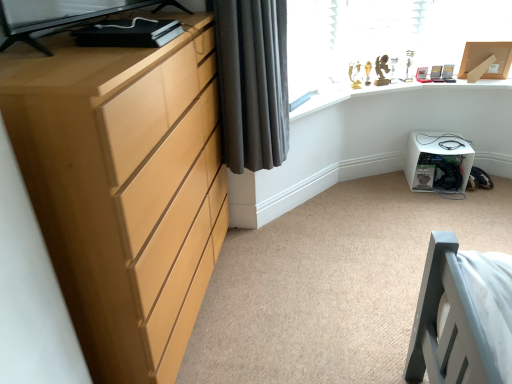
Question: Considering the relative sizes of dark grey fabric curtain at upper left and white plastic storage box at lower right in the image provided, is dark grey fabric curtain at upper left wider than white plastic storage box at lower right?

Choices:
 (A) no
 (B) yes

Answer: (B)

Question: Is dark grey fabric curtain at upper left not within white plastic storage box at lower right?

Choices:
 (A) yes
 (B) no

Answer: (A)

Question: From the image's perspective, does dark grey fabric curtain at upper left appear lower than white plastic storage box at lower right?

Choices:
 (A) yes
 (B) no

Answer: (B)

Question: From a real-world perspective, is dark grey fabric curtain at upper left physically below white plastic storage box at lower right?

Choices:
 (A) no
 (B) yes

Answer: (A)

Question: Could you tell me if dark grey fabric curtain at upper left is facing white plastic storage box at lower right?

Choices:
 (A) yes
 (B) no

Answer: (B)

Question: From a real-world perspective, is light wood chest of drawers at left positioned above or below white plastic storage box at lower right?

Choices:
 (A) above
 (B) below

Answer: (A)

Question: From the image's perspective, is light wood chest of drawers at left positioned above or below white plastic storage box at lower right?

Choices:
 (A) above
 (B) below

Answer: (B)

Question: Looking at the image, does light wood chest of drawers at left seem bigger or smaller compared to white plastic storage box at lower right?

Choices:
 (A) big
 (B) small

Answer: (A)

Question: Considering their positions, is light wood chest of drawers at left located in front of or behind white plastic storage box at lower right?

Choices:
 (A) front
 (B) behind

Answer: (A)

Question: From their relative heights in the image, would you say light wood chest of drawers at left is taller or shorter than dark grey fabric curtain at upper left?

Choices:
 (A) tall
 (B) short

Answer: (A)

Question: Considering the positions of light wood chest of drawers at left and dark grey fabric curtain at upper left in the image, is light wood chest of drawers at left bigger or smaller than dark grey fabric curtain at upper left?

Choices:
 (A) small
 (B) big

Answer: (B)

Question: Considering their positions, is light wood chest of drawers at left located in front of or behind dark grey fabric curtain at upper left?

Choices:
 (A) behind
 (B) front

Answer: (B)

Question: Is point (54, 135) closer or farther from the camera than point (225, 94)?

Choices:
 (A) farther
 (B) closer

Answer: (B)

Question: Relative to white plastic storage box at lower right, is gold metallic trophy case at upper right in front or behind?

Choices:
 (A) behind
 (B) front

Answer: (B)

Question: Is gold metallic trophy case at upper right wider or thinner than white plastic storage box at lower right?

Choices:
 (A) thin
 (B) wide

Answer: (B)